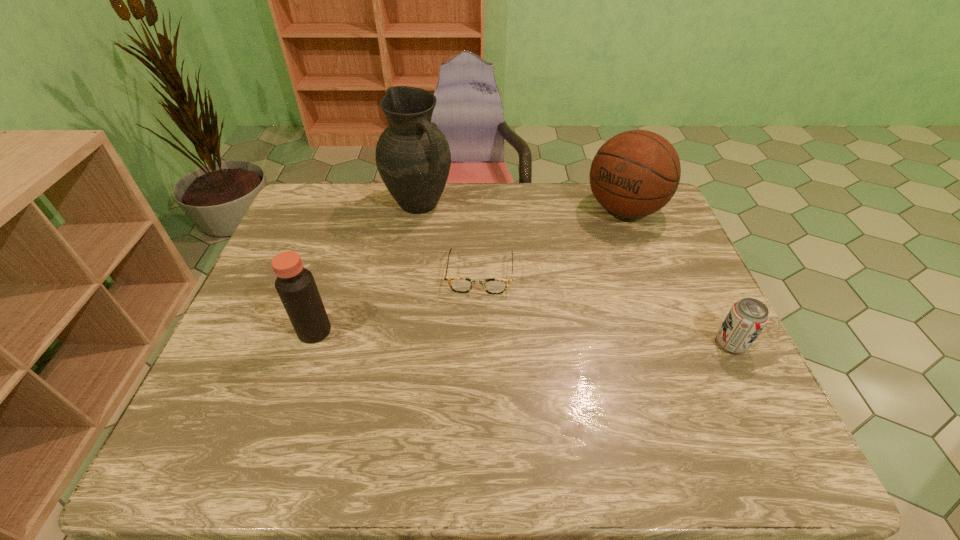
Identify the location of vacant point located between the beer can and the third nearest object. Image resolution: width=960 pixels, height=540 pixels. (605, 309).

At what (x,y) coordinates should I click in order to perform the action: click on unoccupied area between the second shortest object and the spectacles. Please return your answer as a coordinate pair (x, y). The height and width of the screenshot is (540, 960). Looking at the image, I should click on (605, 309).

Identify the location of free space between the second shortest object and the basketball. (678, 276).

Locate an element on the screen. This screenshot has height=540, width=960. vacant space that's between the second shortest object and the spectacles is located at coordinates (605, 309).

In order to click on free space that is in between the beer can and the third nearest object in this screenshot , I will do `click(605, 309)`.

You are a GUI agent. You are given a task and a screenshot of the screen. Output one action in this format:
    pyautogui.click(x=<x>, y=<y>)
    Task: Click on the vacant space that is in between the pitcher and the spectacles
    
    Given the screenshot: What is the action you would take?
    pyautogui.click(x=449, y=239)

The width and height of the screenshot is (960, 540). Find the location of `vacant space that's between the pitcher and the fourth tallest object`. vacant space that's between the pitcher and the fourth tallest object is located at coordinates (575, 273).

This screenshot has width=960, height=540. I want to click on unoccupied area between the tallest object and the vinegar, so click(x=367, y=267).

The image size is (960, 540). In order to click on free spot between the shortest object and the beer can in this screenshot , I will do `click(605, 309)`.

Where is `object that is the fourth closest to the shortest object`? This screenshot has width=960, height=540. object that is the fourth closest to the shortest object is located at coordinates (746, 319).